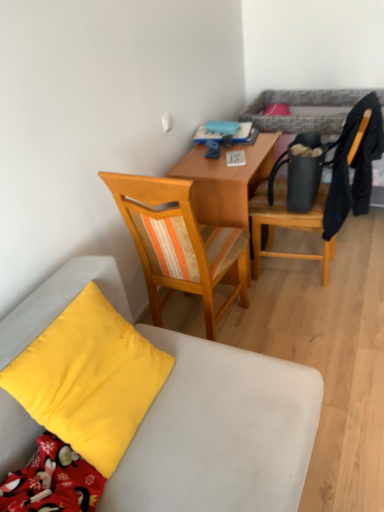
Question: Which is correct: black fabric bed at upper right is inside wooden chair at center, arranged as the 1th chair when viewed from the left, or outside of it?

Choices:
 (A) inside
 (B) outside

Answer: (B)

Question: In terms of height, does black fabric bed at upper right look taller or shorter compared to wooden chair at center, arranged as the 1th chair when viewed from the left?

Choices:
 (A) short
 (B) tall

Answer: (A)

Question: Which object is the farthest from the wooden chair at center, arranged as the 2th chair when viewed from the right?

Choices:
 (A) matte black chair at upper right, the first chair in the right-to-left sequence
 (B) wooden desk at center
 (C) yellow matte pillow at lower left
 (D) black fabric bed at upper right
 (E) wooden chair at center, arranged as the 1th chair when viewed from the left

Answer: (D)

Question: Which of these objects is positioned farthest from the wooden desk at center?

Choices:
 (A) black fabric bed at upper right
 (B) matte black chair at upper right, the first chair in the right-to-left sequence
 (C) yellow matte pillow at lower left
 (D) wooden chair at center, arranged as the 1th chair when viewed from the left
 (E) wooden chair at center, arranged as the 2th chair when viewed from the right

Answer: (C)